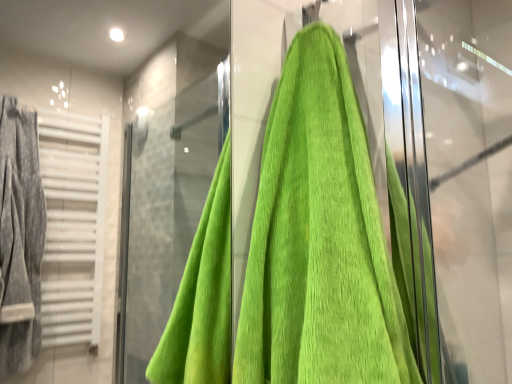
Question: Is green towel at right to the left of green cotton towel at center from the viewer's perspective?

Choices:
 (A) no
 (B) yes

Answer: (A)

Question: Considering the relative sizes of green towel at right and green cotton towel at center in the image provided, is green towel at right smaller than green cotton towel at center?

Choices:
 (A) no
 (B) yes

Answer: (A)

Question: Is green towel at right aimed at green cotton towel at center?

Choices:
 (A) yes
 (B) no

Answer: (B)

Question: Would you say green towel at right is outside green cotton towel at center?

Choices:
 (A) no
 (B) yes

Answer: (B)

Question: Is green towel at right with green cotton towel at center?

Choices:
 (A) yes
 (B) no

Answer: (B)

Question: From a real-world perspective, is green towel at right on green cotton towel at center?

Choices:
 (A) no
 (B) yes

Answer: (B)

Question: From the image's perspective, is green cotton towel at center on top of green towel at right?

Choices:
 (A) yes
 (B) no

Answer: (B)

Question: From a real-world perspective, is green cotton towel at center located beneath green towel at right?

Choices:
 (A) yes
 (B) no

Answer: (A)

Question: Is green cotton towel at center outside of green towel at right?

Choices:
 (A) yes
 (B) no

Answer: (A)

Question: Is green cotton towel at center taller than green towel at right?

Choices:
 (A) yes
 (B) no

Answer: (B)

Question: Is green cotton towel at center at the right side of green towel at right?

Choices:
 (A) yes
 (B) no

Answer: (B)

Question: Is green cotton towel at center positioned behind green towel at right?

Choices:
 (A) yes
 (B) no

Answer: (B)

Question: From their relative heights in the image, would you say green cotton towel at center is taller or shorter than green towel at right?

Choices:
 (A) tall
 (B) short

Answer: (B)